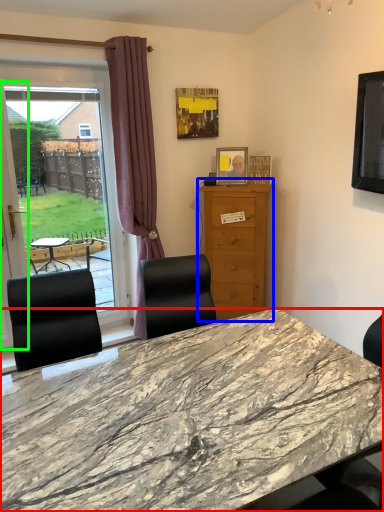
Question: Which object is positioned closest to desk (highlighted by a red box)? Select from cabinetry (highlighted by a blue box) and screen door (highlighted by a green box).

Choices:
 (A) cabinetry
 (B) screen door

Answer: (A)